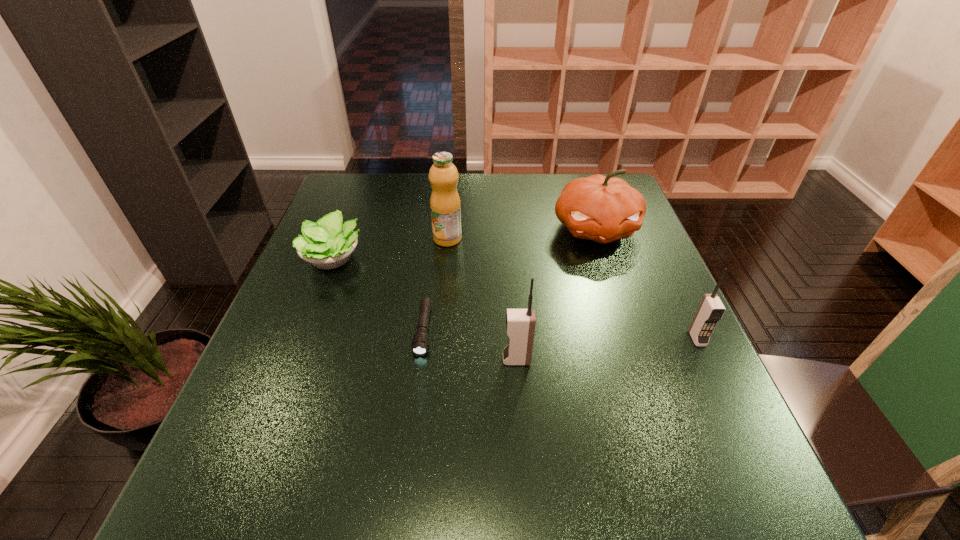
The width and height of the screenshot is (960, 540). In order to click on the fourth object from left to right in this screenshot , I will do tap(520, 323).

The width and height of the screenshot is (960, 540). What are the coordinates of `the left cellular telephone` in the screenshot? It's located at 520,323.

Where is `the right cellular telephone`? This screenshot has width=960, height=540. the right cellular telephone is located at coordinates (711, 309).

Identify the location of the shorter cellular telephone. Image resolution: width=960 pixels, height=540 pixels. (711, 309).

The width and height of the screenshot is (960, 540). Identify the location of fruit juice. pos(445,206).

Where is `pumpkin`? This screenshot has width=960, height=540. pumpkin is located at coordinates (600, 208).

I want to click on lettuce, so click(327, 244).

Where is `the fifth tallest object`? the fifth tallest object is located at coordinates (327, 244).

You are a GUI agent. You are given a task and a screenshot of the screen. Output one action in this format:
    pyautogui.click(x=<x>, y=<y>)
    Task: Click on the flashlight
    
    Given the screenshot: What is the action you would take?
    420,342

What are the coordinates of `free space located on the front-facing side of the taller cellular telephone` in the screenshot? It's located at (425, 360).